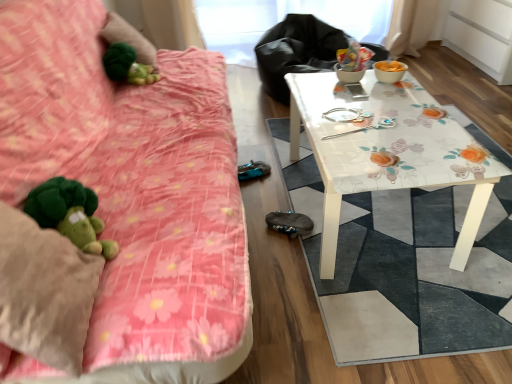
Where is `free spot above floral glass table at center (from a real-world perspective)`? free spot above floral glass table at center (from a real-world perspective) is located at coordinates (379, 117).